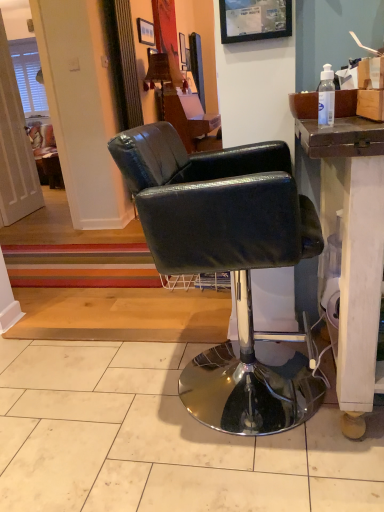
Question: Can you confirm if brown cardboard box at upper right is wider than transparent plastic bottle at upper right?

Choices:
 (A) no
 (B) yes

Answer: (B)

Question: Is brown cardboard box at upper right oriented towards transparent plastic bottle at upper right?

Choices:
 (A) yes
 (B) no

Answer: (B)

Question: Is transparent plastic bottle at upper right at the back of brown cardboard box at upper right?

Choices:
 (A) yes
 (B) no

Answer: (B)

Question: From a real-world perspective, is brown cardboard box at upper right on top of transparent plastic bottle at upper right?

Choices:
 (A) no
 (B) yes

Answer: (A)

Question: Is brown cardboard box at upper right positioned behind transparent plastic bottle at upper right?

Choices:
 (A) no
 (B) yes

Answer: (B)

Question: Does brown cardboard box at upper right appear on the right side of transparent plastic bottle at upper right?

Choices:
 (A) no
 (B) yes

Answer: (B)

Question: Is matte plastic picture frame at upper center, the first picture frame in the front-to-back sequence, further to camera compared to black leather chair at center?

Choices:
 (A) no
 (B) yes

Answer: (B)

Question: Is matte plastic picture frame at upper center, which appears as the 2th picture frame when viewed from the back, positioned far away from black leather chair at center?

Choices:
 (A) no
 (B) yes

Answer: (A)

Question: Considering the relative sizes of matte plastic picture frame at upper center, the 1th picture frame when ordered from right to left, and black leather chair at center in the image provided, is matte plastic picture frame at upper center, the 1th picture frame when ordered from right to left, taller than black leather chair at center?

Choices:
 (A) yes
 (B) no

Answer: (B)

Question: Is matte plastic picture frame at upper center, the first picture frame in the front-to-back sequence, located outside black leather chair at center?

Choices:
 (A) yes
 (B) no

Answer: (A)

Question: Could you tell me if matte plastic picture frame at upper center, which appears as the 2th picture frame when viewed from the back, is facing black leather chair at center?

Choices:
 (A) yes
 (B) no

Answer: (B)

Question: Can black leather chair at center be found inside matte plastic picture frame at upper center, which appears as the 2th picture frame when viewed from the back?

Choices:
 (A) yes
 (B) no

Answer: (B)

Question: Can you confirm if black leather chair at center is positioned to the right of transparent plastic bottle at upper right?

Choices:
 (A) yes
 (B) no

Answer: (B)